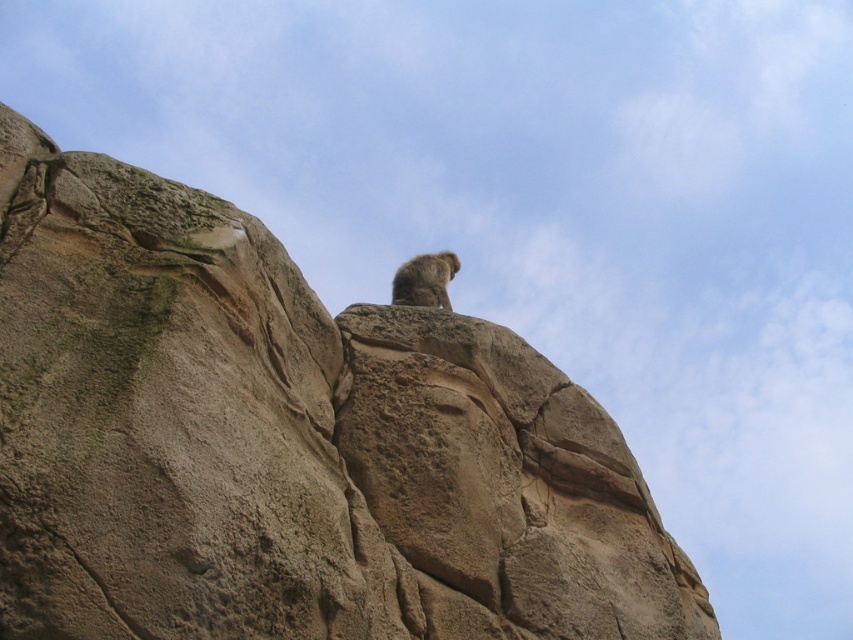
You are a geologist examining the image of the natural scene. You need to locate the brown rough rock at upper center. What are the coordinates where you can find it?

The brown rough rock at upper center can be found at coordinates point (286, 444).